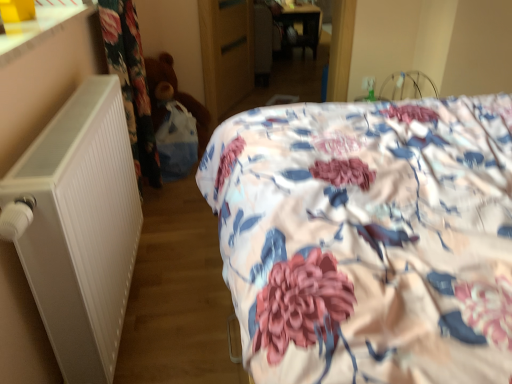
Question: In terms of height, does floral fabric bed at center look taller or shorter compared to wooden wardrobe at center?

Choices:
 (A) tall
 (B) short

Answer: (A)

Question: Is point (305, 137) positioned closer to the camera than point (211, 13)?

Choices:
 (A) farther
 (B) closer

Answer: (B)

Question: Considering the real-world distances, which object is closest to the white matte radiator at left?

Choices:
 (A) brown plush teddy bear at left
 (B) wooden wardrobe at center
 (C) floral fabric bed at center

Answer: (C)

Question: Considering the real-world distances, which object is closest to the brown plush teddy bear at left?

Choices:
 (A) white matte radiator at left
 (B) wooden wardrobe at center
 (C) floral fabric bed at center

Answer: (B)